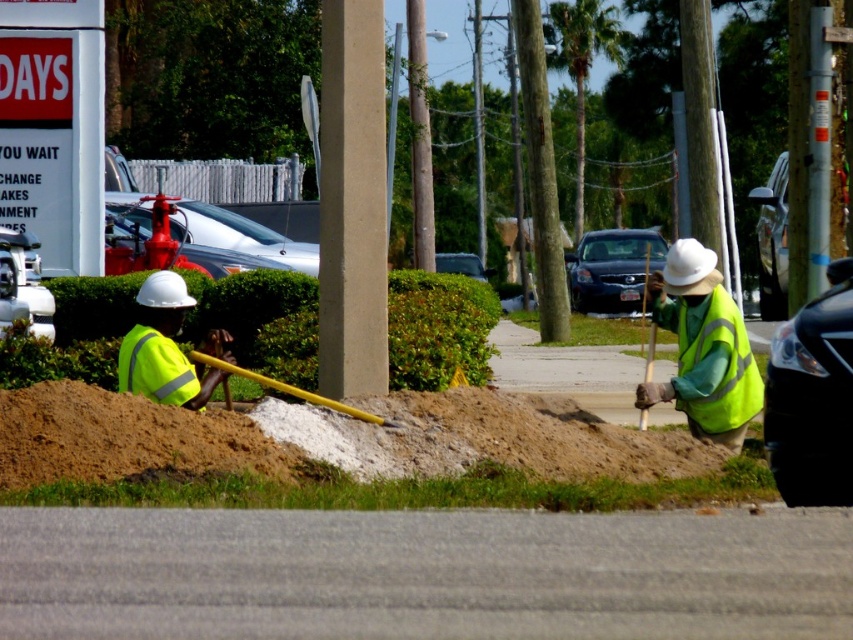
You are a delivery driver who needs to park your vehicle near the construction site shown in the image. The parking spot you want is marked by the point at coordinates (125, 436). However, you notice that the area around this point is covered with brown sandy dirt at lower left. Is this parking spot suitable for parking your vehicle?

The point at coordinates (125, 436) indicates brown sandy dirt at lower left, which suggests the area is not paved. Parking your vehicle there may cause damage to the tires or make it difficult to maneuver due to the loose, uneven terrain of the brown sandy dirt at lower left.

You are a delivery driver approaching the construction site. You need to know if there is a safety vest visible at the point you are focusing on, which is at coordinates point (x=703, y=348). Is there a high visibility yellow vest there?

Yes, at point (x=703, y=348) there is a high visibility yellow vest at right present.

You are a pedestrian walking on the sidewalk and see the brown sandy dirt at center and the green reflective safety vest at right. Which object is closer to your eye level?

The green reflective safety vest at right is closer to your eye level because it is taller than the brown sandy dirt at center.